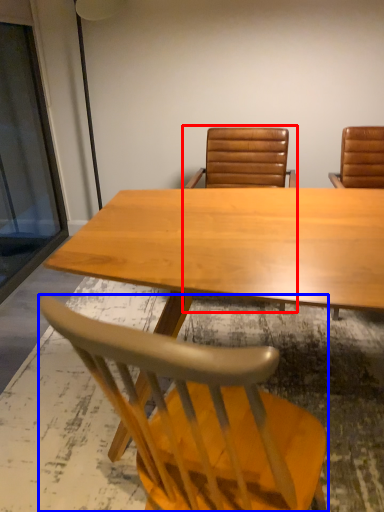
Question: Among these objects, which one is farthest to the camera, chair (highlighted by a red box) or chair (highlighted by a blue box)?

Choices:
 (A) chair
 (B) chair

Answer: (A)